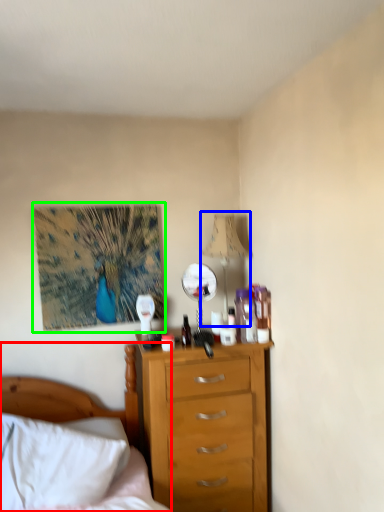
Question: Estimate the real-world distances between objects in this image. Which object is closer to bed (highlighted by a red box), lamp (highlighted by a blue box) or picture frame (highlighted by a green box)?

Choices:
 (A) lamp
 (B) picture frame

Answer: (B)